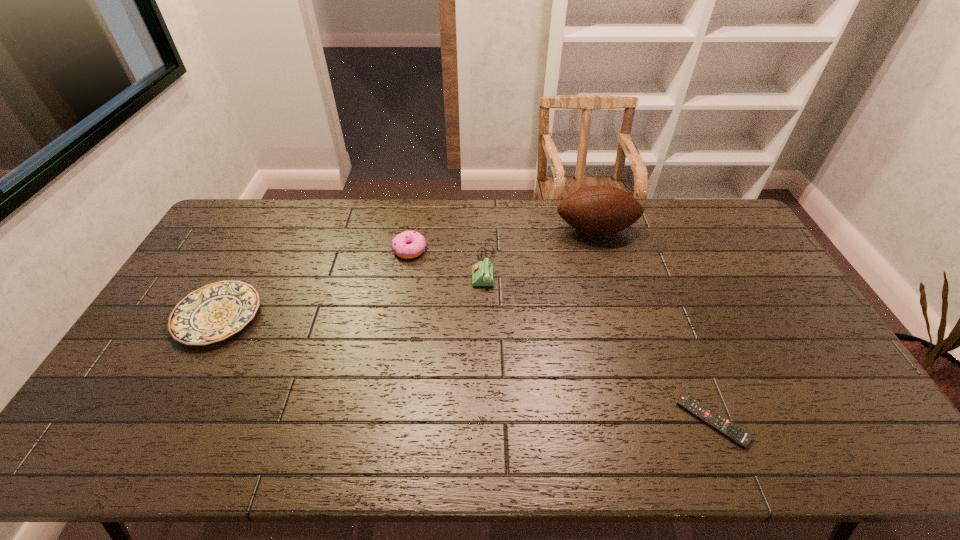
Where is `free space at the left edge`? free space at the left edge is located at coordinates (218, 268).

Where is `free space at the right edge of the desktop`? free space at the right edge of the desktop is located at coordinates (821, 351).

The height and width of the screenshot is (540, 960). Identify the location of free space between the nearest object and the third object from left to right. (598, 345).

This screenshot has height=540, width=960. I want to click on empty space between the tallest object and the telephone, so click(x=540, y=249).

Locate an element on the screen. free space between the leftmost object and the shortest object is located at coordinates (466, 368).

Where is `vacant area that lies between the football and the shortest object`? vacant area that lies between the football and the shortest object is located at coordinates (654, 325).

At what (x,y) coordinates should I click in order to perform the action: click on free space between the second shortest object and the tallest object. Please return your answer as a coordinate pair (x, y). The width and height of the screenshot is (960, 540). Looking at the image, I should click on (407, 273).

Locate an element on the screen. The width and height of the screenshot is (960, 540). empty location between the doughnut and the tallest object is located at coordinates (x=503, y=240).

You are a GUI agent. You are given a task and a screenshot of the screen. Output one action in this format:
    pyautogui.click(x=<x>, y=<y>)
    Task: Click on the vacant space that is in between the nearest object and the telephone
    This screenshot has width=960, height=540.
    Given the screenshot: What is the action you would take?
    pyautogui.click(x=598, y=345)

This screenshot has width=960, height=540. Find the location of `vacant space in between the telephone and the football`. vacant space in between the telephone and the football is located at coordinates (540, 249).